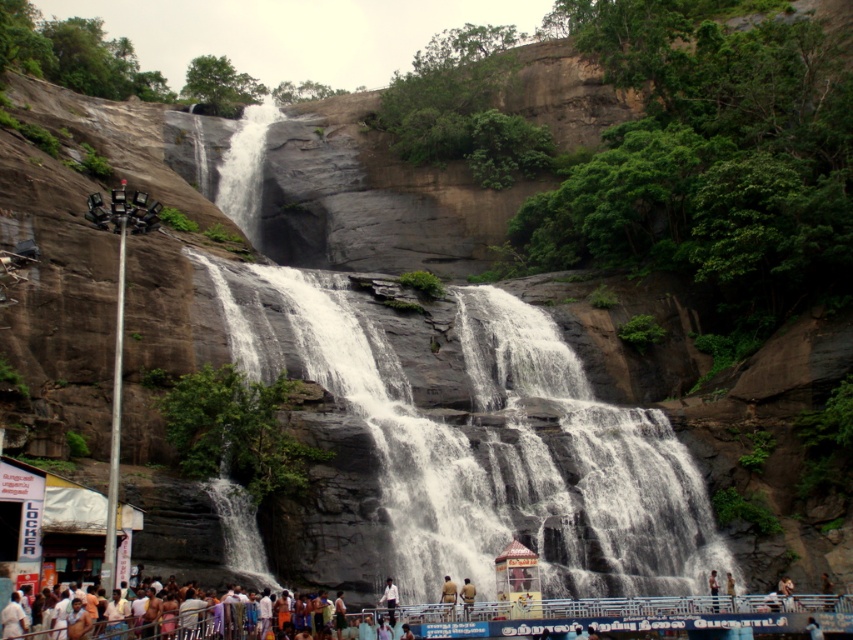
Question: Which point is closer to the camera?

Choices:
 (A) white shirt at lower center
 (B) light brown wooden pole at center
 (C) light brown skin at lower center

Answer: (A)

Question: Is white shirt at lower center further to camera compared to skinny person at center?

Choices:
 (A) no
 (B) yes

Answer: (A)

Question: Which point is closer to the camera?

Choices:
 (A) (390, 593)
 (B) (218, 609)
 (C) (468, 586)

Answer: (B)

Question: Is gray stone waterfall at center positioned before light brown skin at lower center?

Choices:
 (A) no
 (B) yes

Answer: (A)

Question: Can you confirm if gray stone waterfall at center is positioned above light brown wooden bench at center?

Choices:
 (A) yes
 (B) no

Answer: (A)

Question: Which point appears farthest from the camera in this image?

Choices:
 (A) (x=717, y=611)
 (B) (x=265, y=314)

Answer: (B)